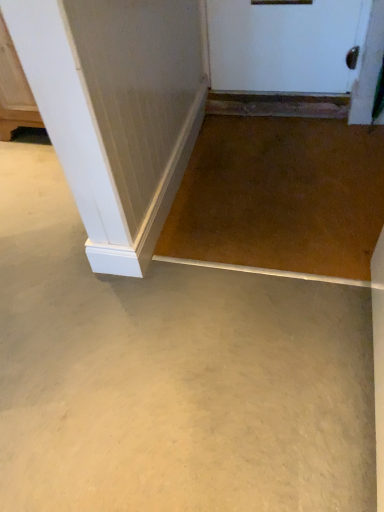
Locate an element on the screen. vacant area on top of smooth concrete floor at center (from a real-world perspective) is located at coordinates (167, 274).